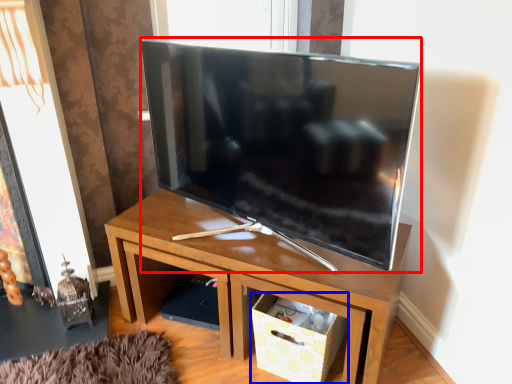
Question: Which object is closer to the camera taking this photo, television (highlighted by a red box) or storage box (highlighted by a blue box)?

Choices:
 (A) television
 (B) storage box

Answer: (A)